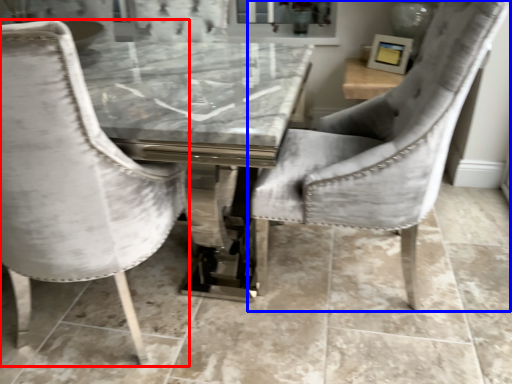
Question: Which point is closer to the camera, chair (highlighted by a red box) or chair (highlighted by a blue box)?

Choices:
 (A) chair
 (B) chair

Answer: (A)